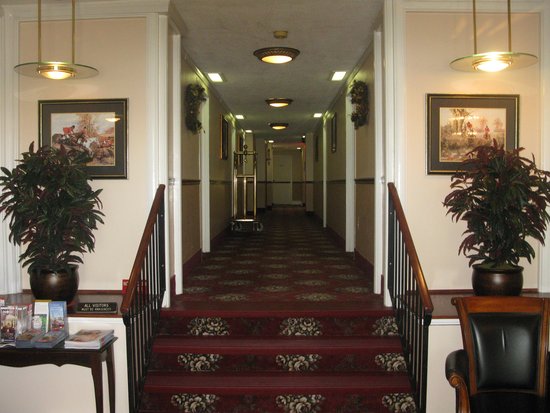
The width and height of the screenshot is (550, 413). I want to click on hanging lights, so click(x=60, y=75), click(x=484, y=69).